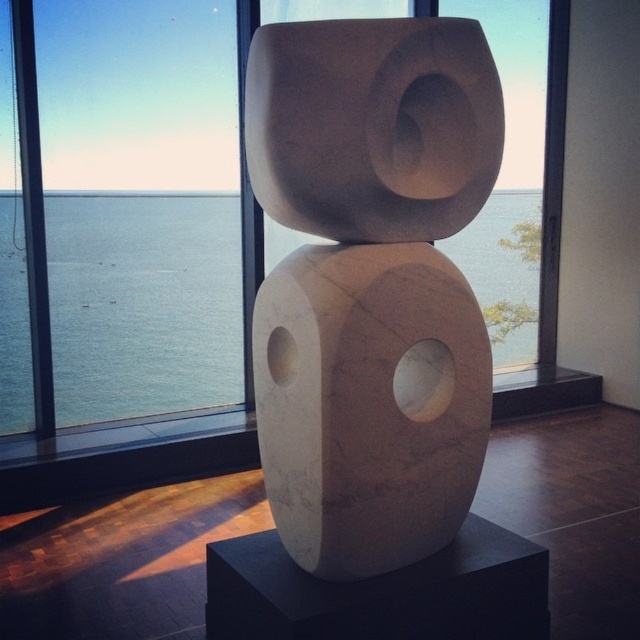
You are an art curator planning to install a new light fixture that must be placed above the white marble sculpture at center. Given that the transparent glass window at center is already at the ceiling level, can the light fixture be safely installed without hitting the window?

The white marble sculpture at center is taller than the transparent glass window at center, so installing the light fixture above the sculpture would not interfere with the window since the sculpture itself already extends beyond the window height.

You are an art conservator tasked with moving the white marble sculpture at center to a storage room located 10 feet away from the transparent glass window at center. Can you safely move the sculpture without exceeding the 10 feet distance limit?

The distance between the white marble sculpture at center and the transparent glass window at center is 7.17 feet. Since the storage room is 10 feet away from the window, moving the sculpture would require a total distance of 7.17 feet plus the distance from the window to the storage room. However, the total distance must not exceed 10 feet. Without knowing the exact distance from the window to the storage room, it is impossible to determine if the total move would stay within the limit. Therefore, more 1.

You are an art curator planning to install a new lighting system for the white marble sculpture at center and the blue water at center. To ensure both are equally illuminated, where should you place the light source?

The white marble sculpture at center is above the blue water at center, so placing the light source directly above both objects would ensure equal illumination.